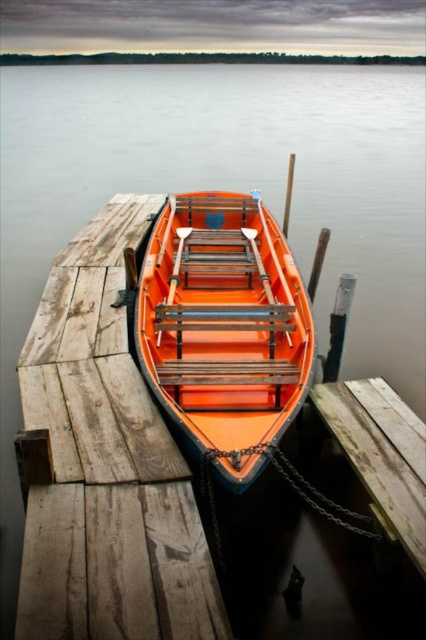
Is wooden dock at center to the right of weathered wood bench at lower center from the viewer's perspective?

In fact, wooden dock at center is to the left of weathered wood bench at lower center.

In the scene shown: How much distance is there between wooden dock at center and weathered wood bench at lower center?

wooden dock at center and weathered wood bench at lower center are 1.69 meters apart from each other.

I want to click on wooden dock at center, so pyautogui.click(x=104, y=465).

Identify the location of wooden dock at center. (104, 465).

Is orange matte wood boat at center smaller than weathered wood bench at lower center?

No.

Which is below, orange matte wood boat at center or weathered wood bench at lower center?

weathered wood bench at lower center is below.

This screenshot has width=426, height=640. In order to click on orange matte wood boat at center in this screenshot , I will do `click(224, 326)`.

Is wooden dock at center above orange matte wood boat at center?

Actually, wooden dock at center is below orange matte wood boat at center.

Can you confirm if wooden dock at center is taller than orange matte wood boat at center?

In fact, wooden dock at center may be shorter than orange matte wood boat at center.

In order to click on wooden dock at center in this screenshot , I will do [x=104, y=465].

At what (x,y) coordinates should I click in order to perform the action: click on wooden dock at center. Please return your answer as a coordinate pair (x, y). Looking at the image, I should click on coord(104,465).